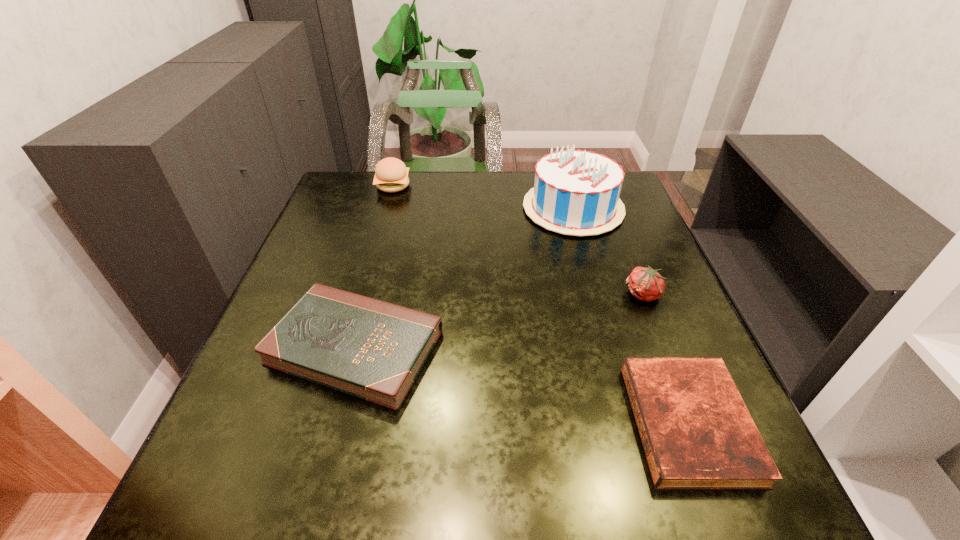
Find the location of a particular element. free space that is in between the birthday cake and the right Bible is located at coordinates (631, 316).

Image resolution: width=960 pixels, height=540 pixels. What are the coordinates of `vacant space that's between the tomato and the tallest object` in the screenshot? It's located at (609, 252).

Locate an element on the screen. free space that is in between the birthday cake and the hamburger is located at coordinates (483, 197).

The image size is (960, 540). What are the coordinates of `free space between the birthday cake and the second shortest object` in the screenshot? It's located at (464, 278).

At what (x,y) coordinates should I click in order to perform the action: click on vacant space that's between the left Bible and the third tallest object. Please return your answer as a coordinate pair (x, y). The height and width of the screenshot is (540, 960). Looking at the image, I should click on (499, 321).

The image size is (960, 540). Find the location of `free space between the tallest object and the third tallest object`. free space between the tallest object and the third tallest object is located at coordinates (609, 252).

Image resolution: width=960 pixels, height=540 pixels. I want to click on vacant region between the birthday cake and the shorter Bible, so click(631, 316).

What are the coordinates of `free space between the fourth shortest object and the taller Bible` in the screenshot? It's located at (374, 266).

Find the location of a particular element. This screenshot has height=540, width=960. the third closest object relative to the hamburger is located at coordinates (646, 284).

Identify which object is located as the fourth nearest to the second tallest object. Please provide its 2D coordinates. Your answer should be formatted as a tuple, i.e. [(x, y)], where the tuple contains the x and y coordinates of a point satisfying the conditions above.

[(697, 433)]